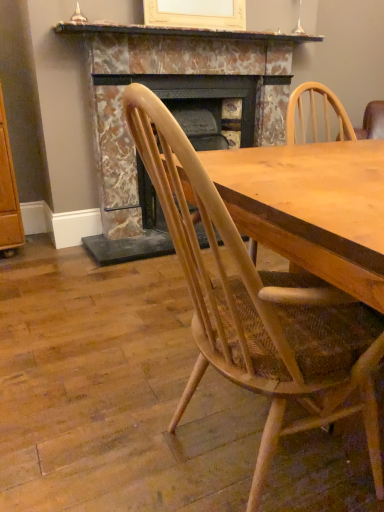
Question: Considering the relative positions of marble mantel at upper center and natural wood chair at center in the image provided, is marble mantel at upper center to the left of natural wood chair at center from the viewer's perspective?

Choices:
 (A) no
 (B) yes

Answer: (B)

Question: From the image's perspective, is marble mantel at upper center beneath natural wood chair at center?

Choices:
 (A) yes
 (B) no

Answer: (B)

Question: Does marble mantel at upper center have a lesser width compared to natural wood chair at center?

Choices:
 (A) no
 (B) yes

Answer: (B)

Question: From a real-world perspective, is marble mantel at upper center under natural wood chair at center?

Choices:
 (A) yes
 (B) no

Answer: (B)

Question: Considering the relative sizes of marble mantel at upper center and natural wood chair at center in the image provided, is marble mantel at upper center wider than natural wood chair at center?

Choices:
 (A) no
 (B) yes

Answer: (A)

Question: Is marble mantel at upper center with natural wood chair at center?

Choices:
 (A) no
 (B) yes

Answer: (A)

Question: Is marble fireplace at center in front of marble mantel at upper center?

Choices:
 (A) yes
 (B) no

Answer: (B)

Question: Can you confirm if marble fireplace at center is thinner than marble mantel at upper center?

Choices:
 (A) no
 (B) yes

Answer: (A)

Question: Is marble fireplace at center at the left side of marble mantel at upper center?

Choices:
 (A) no
 (B) yes

Answer: (B)

Question: Is marble fireplace at center in contact with marble mantel at upper center?

Choices:
 (A) no
 (B) yes

Answer: (A)

Question: Is marble mantel at upper center at the back of marble fireplace at center?

Choices:
 (A) no
 (B) yes

Answer: (A)

Question: Considering the relative sizes of marble fireplace at center and marble mantel at upper center in the image provided, is marble fireplace at center bigger than marble mantel at upper center?

Choices:
 (A) yes
 (B) no

Answer: (A)

Question: From a real-world perspective, is natural wood chair at center on top of marble fireplace at center?

Choices:
 (A) yes
 (B) no

Answer: (B)